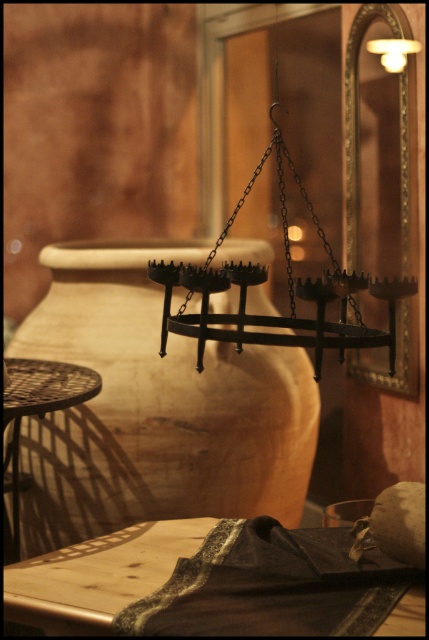
Question: In this image, where is matte black chandelier at upper center located relative to wooden table at lower left?

Choices:
 (A) left
 (B) right

Answer: (A)

Question: Which object appears closest to the camera in this image?

Choices:
 (A) wooden table at lower left
 (B) metallic mesh table at lower left

Answer: (A)

Question: In this image, where is black metal chandelier at upper center located relative to metallic mesh table at lower left?

Choices:
 (A) below
 (B) above

Answer: (B)

Question: Can you confirm if metallic mesh table at lower left is positioned below matte white light fixture at upper right?

Choices:
 (A) no
 (B) yes

Answer: (B)

Question: Which point is farther to the camera?

Choices:
 (A) black metal chandelier at upper center
 (B) metallic mesh table at lower left
 (C) matte white light fixture at upper right

Answer: (C)

Question: Among these objects, which one is nearest to the camera?

Choices:
 (A) black metal chandelier at upper center
 (B) metallic mesh table at lower left
 (C) matte white light fixture at upper right
 (D) wooden table at lower left

Answer: (D)